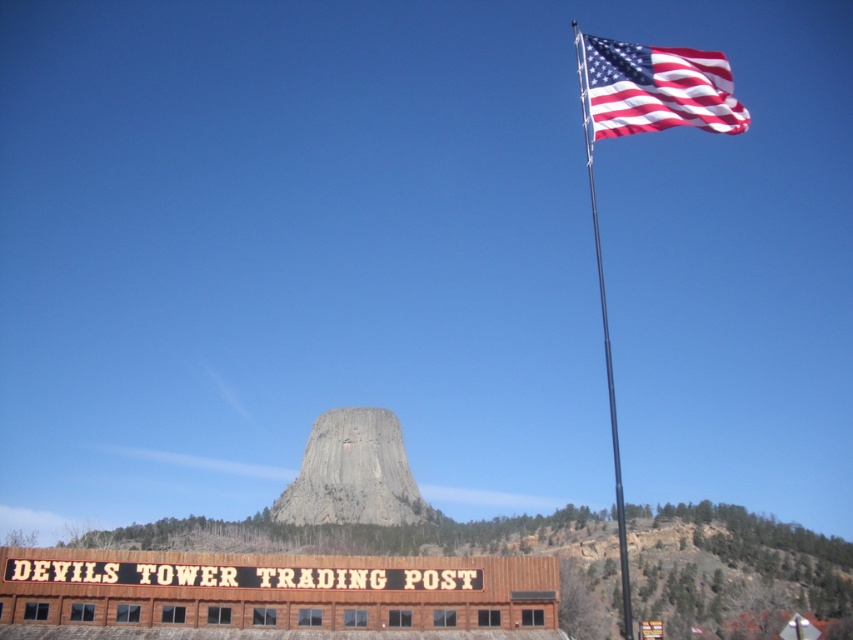
You are a photographer planning to capture the gray rock formation at center and the metallic flag pole at upper right in the same frame. Based on their heights, which object should appear taller in your photo?

The metallic flag pole at upper right should appear taller in the photo because the gray rock formation at center has a lesser height compared to it.

You are a tourist visiting Devil s Tower and you see the american flag at upper right and the metallic flag pole at upper right. Which object is higher in the image?

The american flag at upper right is higher than the metallic flag pole at upper right.

You are standing at the base of Devil s Tower and want to take a photo that includes both the american flag at upper right and the metallic flag pole at upper right. Given that your camera has a maximum zoom range of 100 feet, will you be able to capture both objects in the same frame without moving closer?

The american flag at upper right is 144.08 feet away from the metallic flag pole at upper right. Since your camera can only zoom up to 100 feet, you will not be able to capture both objects in the same frame without moving closer.